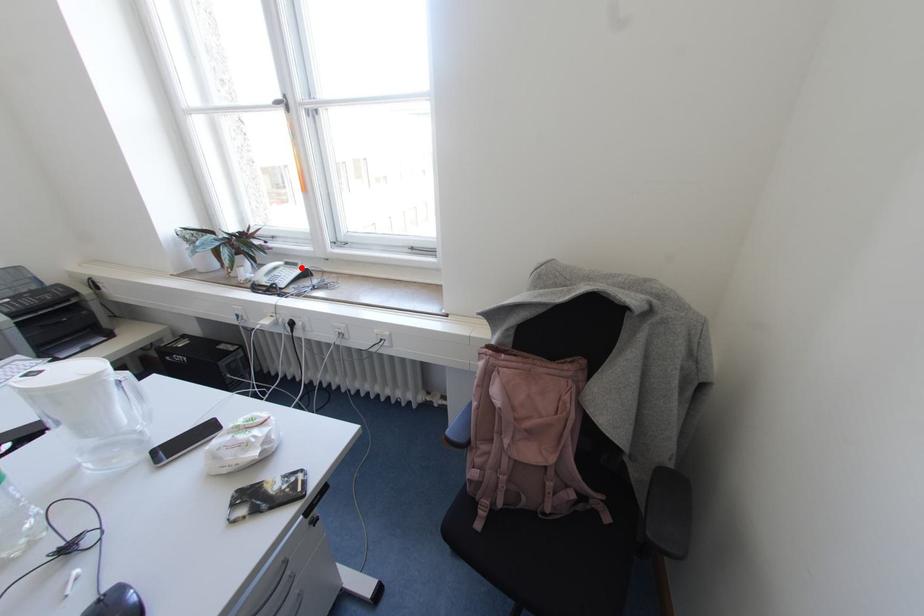
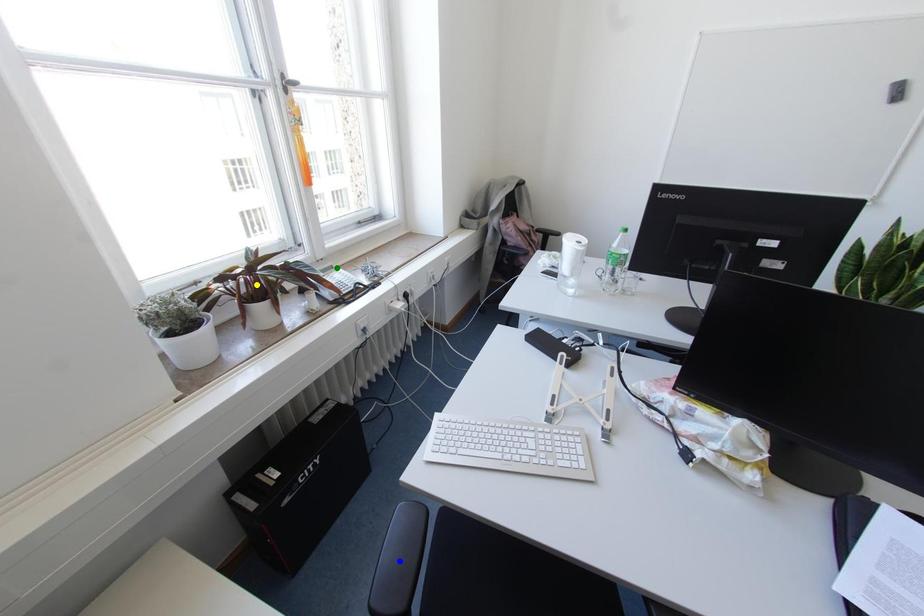
Question: I am providing you with two images of the same scene from different viewpoints. A red point is marked on the first image. You are given multiple points on the second image. In image 2, which mark is for the same physical point as the one in image 1?

Choices:
 (A) green point
 (B) blue point
 (C) yellow point

Answer: (A)